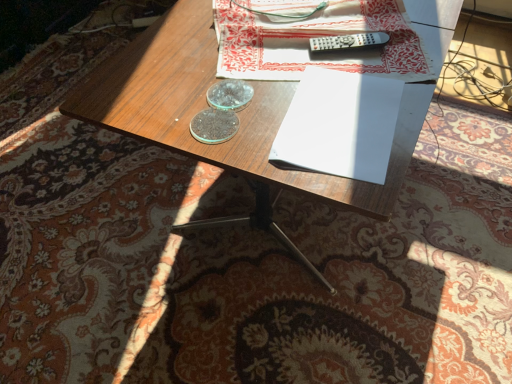
Question: Could you tell me if white paper at upper center is turned towards white paper at center?

Choices:
 (A) no
 (B) yes

Answer: (B)

Question: Is white paper at center surrounded by white paper at upper center?

Choices:
 (A) yes
 (B) no

Answer: (B)

Question: Is there a large distance between white paper at upper center and white paper at center?

Choices:
 (A) yes
 (B) no

Answer: (B)

Question: Can you confirm if white paper at upper center is wider than white paper at center?

Choices:
 (A) no
 (B) yes

Answer: (B)

Question: Is white paper at upper center positioned beyond the bounds of white paper at center?

Choices:
 (A) no
 (B) yes

Answer: (B)

Question: From a real-world perspective, does white paper at upper center stand above white paper at center?

Choices:
 (A) no
 (B) yes

Answer: (B)

Question: Is black plastic remote at upper center positioned far away from wooden desk at center?

Choices:
 (A) yes
 (B) no

Answer: (B)

Question: Is black plastic remote at upper center next to wooden desk at center and touching it?

Choices:
 (A) no
 (B) yes

Answer: (A)

Question: Does black plastic remote at upper center have a greater height compared to wooden desk at center?

Choices:
 (A) no
 (B) yes

Answer: (A)

Question: Does black plastic remote at upper center lie behind wooden desk at center?

Choices:
 (A) no
 (B) yes

Answer: (B)

Question: Is black plastic remote at upper center at the right side of wooden desk at center?

Choices:
 (A) no
 (B) yes

Answer: (B)

Question: Could you tell me if black plastic remote at upper center is turned towards wooden desk at center?

Choices:
 (A) yes
 (B) no

Answer: (B)

Question: From the image's perspective, is black plastic remote at upper center on white paper at upper center?

Choices:
 (A) no
 (B) yes

Answer: (A)